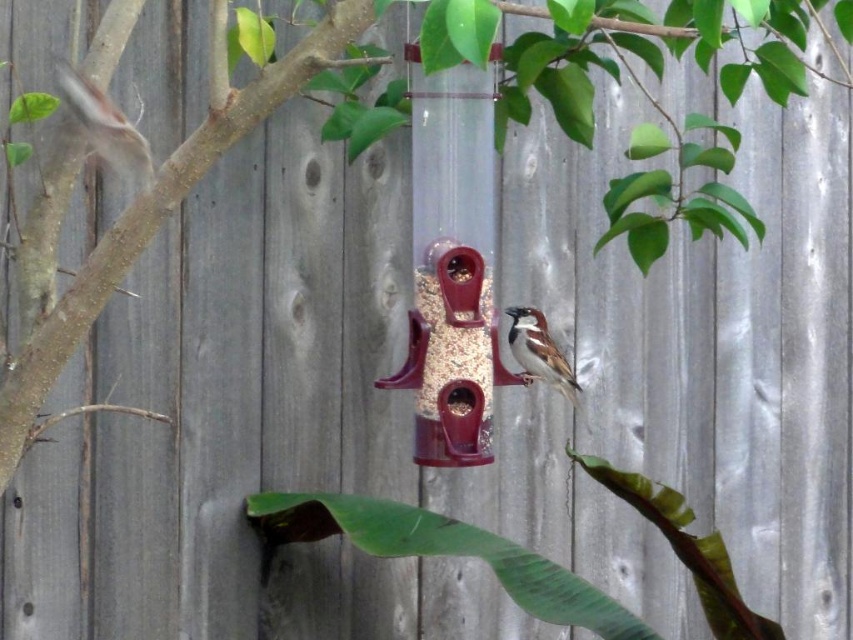
Is point (136, 172) positioned in front of point (556, 371)?

Yes.

Is the position of matte white sparrow at upper left less distant than that of brown speckled feathers at center?

That is True.

Does point (117, 113) come closer to viewer compared to point (509, 337)?

Yes, it is.

Image resolution: width=853 pixels, height=640 pixels. Identify the location of matte white sparrow at upper left. (105, 125).